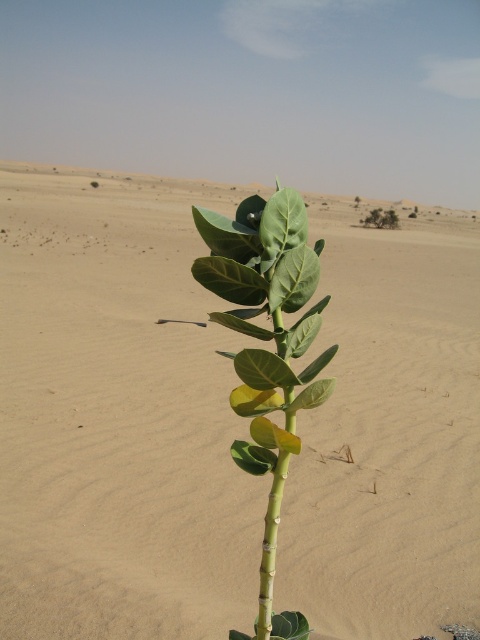
You are a desert explorer who just found a green matte leafy plant at center and a green matte leaf at center in the middle of the desert. Which one is positioned more to the east?

The green matte leafy plant at center is to the right of green matte leaf at center, so if you are facing north, the leafy plant would be more to the east.

You are a desert explorer who needs to place a small tent. You have two options for placement based on the image. The first option is on the sandy beige sand at center, and the second is on the green matte leaf at center. Considering the size of the objects, which location would provide a larger surface area for the tent?

The sandy beige sand at center might be wider than green matte leaf at center, so the sandy beige sand at center would provide a larger surface area for placing the tent.